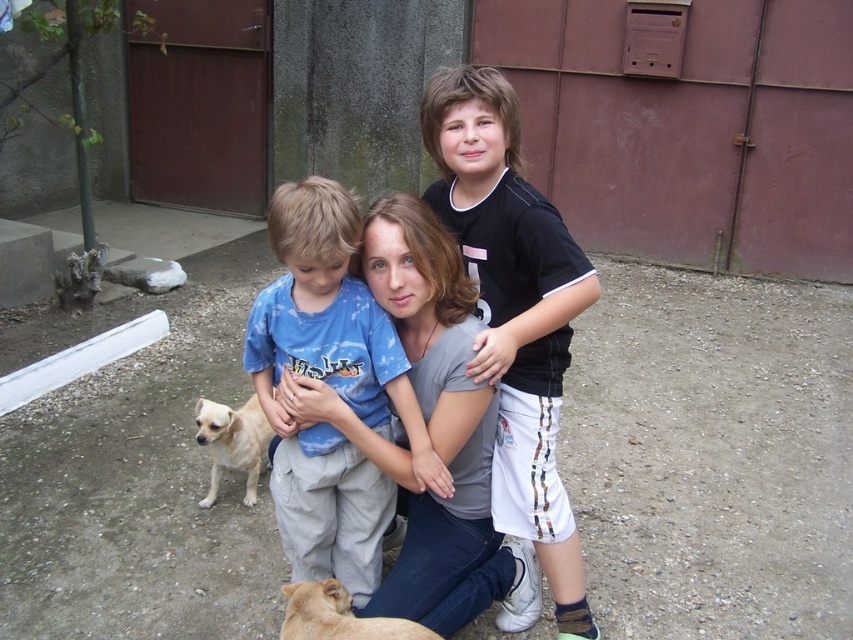
Does blue tie-dye t-shirt at center appear on the left side of light brown fur at lower center?

Yes, blue tie-dye t-shirt at center is to the left of light brown fur at lower center.

Is blue tie-dye t-shirt at center bigger than light brown fur at lower center?

Correct, blue tie-dye t-shirt at center is larger in size than light brown fur at lower center.

Between point (291, 500) and point (392, 637), which one is positioned in front?

Point (392, 637) is more forward.

The image size is (853, 640). I want to click on blue tie-dye t-shirt at center, so click(x=331, y=387).

Does black cotton shirt at center have a greater width compared to light brown fur at lower center?

Yes, black cotton shirt at center is wider than light brown fur at lower center.

How much distance is there between black cotton shirt at center and light brown fur at lower center?

black cotton shirt at center and light brown fur at lower center are 28.70 inches apart.

Measure the distance between black cotton shirt at center and camera.

They are 6.03 feet apart.

What are the coordinates of `black cotton shirt at center` in the screenshot? It's located at (514, 310).

Is black cotton shirt at center to the right of light brown fur at lower left from the viewer's perspective?

Indeed, black cotton shirt at center is positioned on the right side of light brown fur at lower left.

Is black cotton shirt at center thinner than light brown fur at lower left?

No.

I want to click on black cotton shirt at center, so click(x=514, y=310).

Locate an element on the screen. black cotton shirt at center is located at coordinates (514, 310).